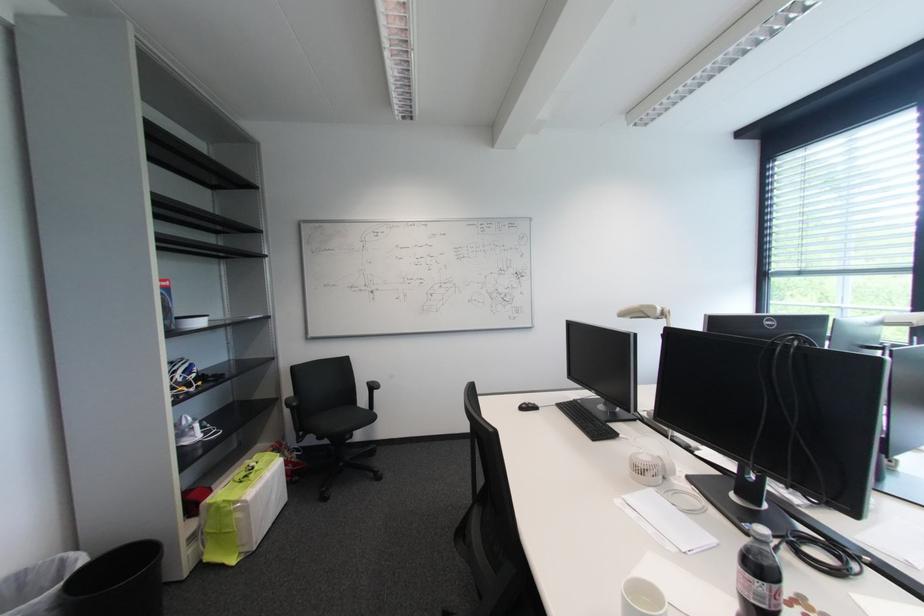
The location [180,370] corresponds to which object?

It corresponds to the bicycle helmet in the image.